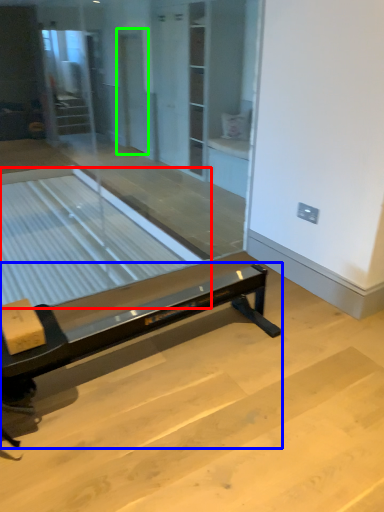
Question: Which object is positioned closest to table (highlighted by a red box)? Select from furniture (highlighted by a blue box) and screen door (highlighted by a green box).

Choices:
 (A) furniture
 (B) screen door

Answer: (B)